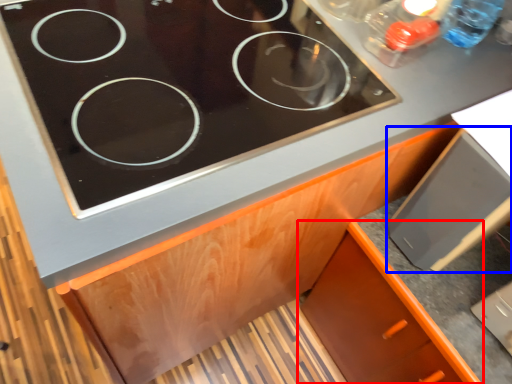
Question: Which object appears closest to the camera in this image, cabinetry (highlighted by a red box) or appliance (highlighted by a blue box)?

Choices:
 (A) cabinetry
 (B) appliance

Answer: (B)